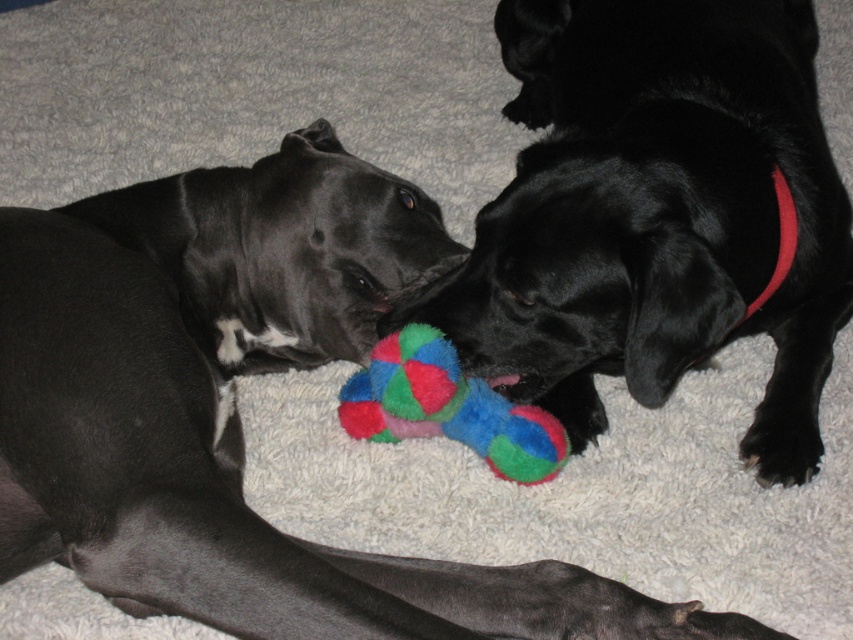
Question: Does shiny black dog at center appear under multicolored plush bone at center?

Choices:
 (A) no
 (B) yes

Answer: (A)

Question: Is shiny black dog at center bigger than multicolored plush bone at center?

Choices:
 (A) no
 (B) yes

Answer: (B)

Question: Can you confirm if shiny black dog at center is positioned to the right of multicolored plush bone at center?

Choices:
 (A) no
 (B) yes

Answer: (B)